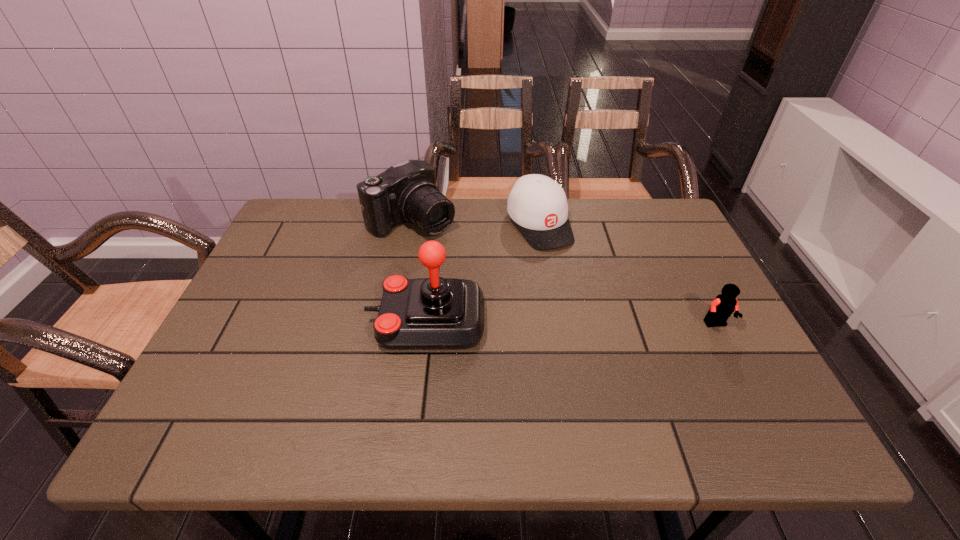
What are the coordinates of `free location located 0.190m on the front-facing side of the baseball cap` in the screenshot? It's located at (586, 297).

This screenshot has height=540, width=960. In order to click on blank area located 0.380m on the lens of the second tallest object in this screenshot , I will do `click(529, 315)`.

Image resolution: width=960 pixels, height=540 pixels. What are the coordinates of `vacant space located 0.280m on the lens of the second tallest object` in the screenshot? It's located at (501, 292).

At what (x,y) coordinates should I click in order to perform the action: click on vacant region located on the lens of the second tallest object. Please return your answer as a coordinate pair (x, y). This screenshot has height=540, width=960. Looking at the image, I should click on (493, 286).

Where is `baseball cap present at the far edge`? baseball cap present at the far edge is located at coordinates (538, 205).

The image size is (960, 540). Identify the location of camera at the far edge. (406, 192).

You are a GUI agent. You are given a task and a screenshot of the screen. Output one action in this format:
    pyautogui.click(x=<x>, y=<y>)
    Task: Click on the object present at the right edge
    Image resolution: width=960 pixels, height=540 pixels.
    Given the screenshot: What is the action you would take?
    pyautogui.click(x=721, y=308)

What are the coordinates of `vacant space at the far edge of the desktop` in the screenshot? It's located at (477, 201).

Image resolution: width=960 pixels, height=540 pixels. What are the coordinates of `free space at the near edge of the desktop` in the screenshot? It's located at (530, 370).

Locate an element on the screen. This screenshot has width=960, height=540. vacant space at the left edge of the desktop is located at coordinates (278, 267).